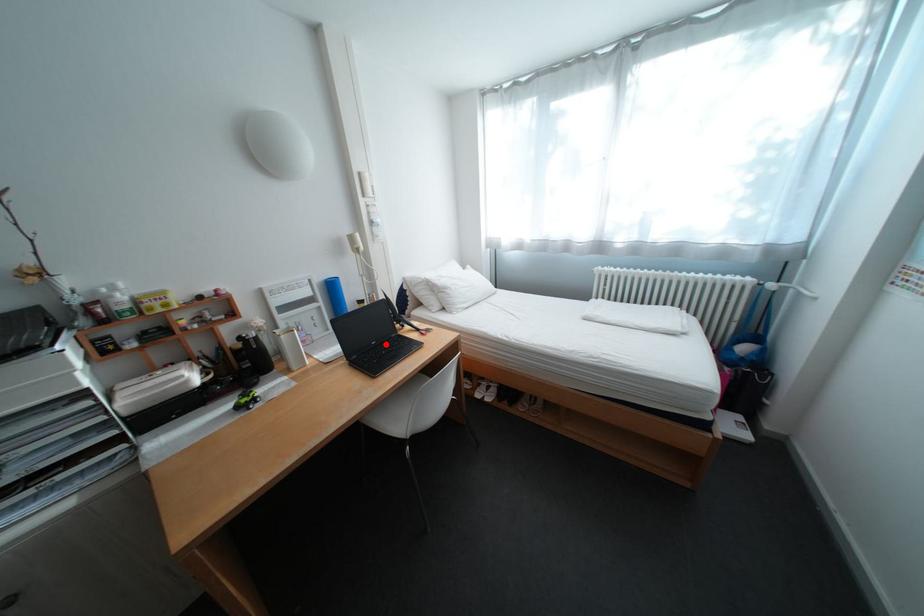
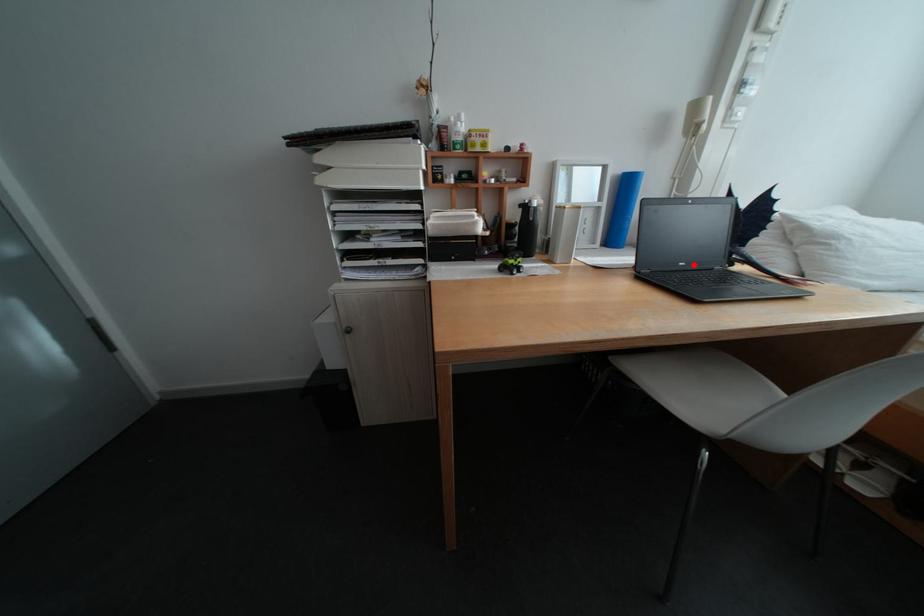
I am providing you with two images of the same scene from different viewpoints. A red point is marked on the first image and another point is marked on the second image. Is the marked point in image1 the same physical position as the marked point in image2?

Yes